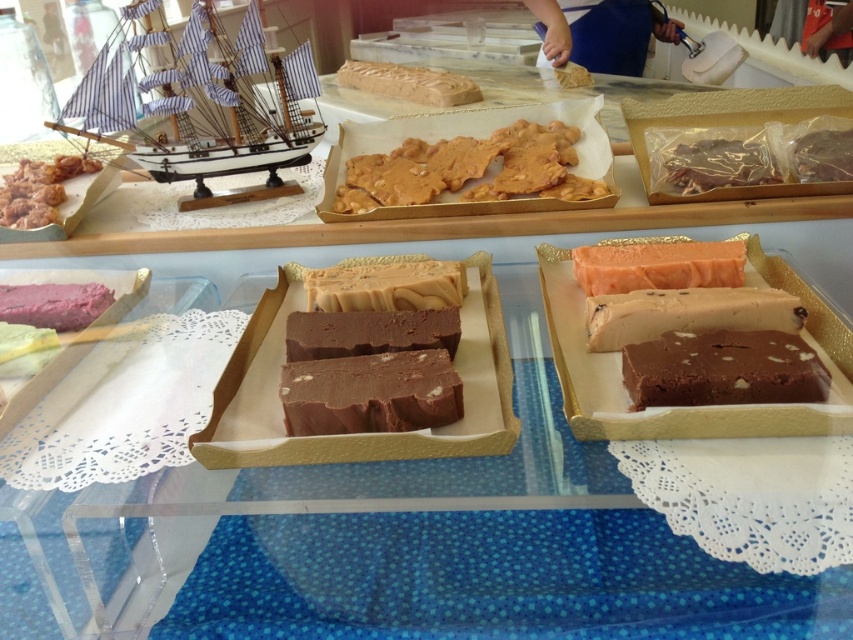
Question: Which of these objects is positioned closest to the brown crumbly chocolate at upper right?

Choices:
 (A) golden crunchy candy at center
 (B) smooth caramel fudge at center

Answer: (A)

Question: Which object is farther from the camera taking this photo?

Choices:
 (A) smooth caramel fudge at center
 (B) white wooden ship at upper left
 (C) salmon-colored fudge at center
 (D) golden crunchy candy at center

Answer: (D)

Question: Can you confirm if smooth caramel fudge at center is positioned to the left of brown crumbly chocolate at upper right?

Choices:
 (A) yes
 (B) no

Answer: (A)

Question: Can you confirm if smooth caramel fudge at center is positioned above smooth caramel bar at center?

Choices:
 (A) yes
 (B) no

Answer: (B)

Question: Which point appears farthest from the camera in this image?

Choices:
 (A) (366, 182)
 (B) (637, 273)
 (C) (401, 269)
 (D) (756, 150)

Answer: (A)

Question: Is smooth caramel fudge at center to the right of smooth caramel bar at center from the viewer's perspective?

Choices:
 (A) yes
 (B) no

Answer: (A)